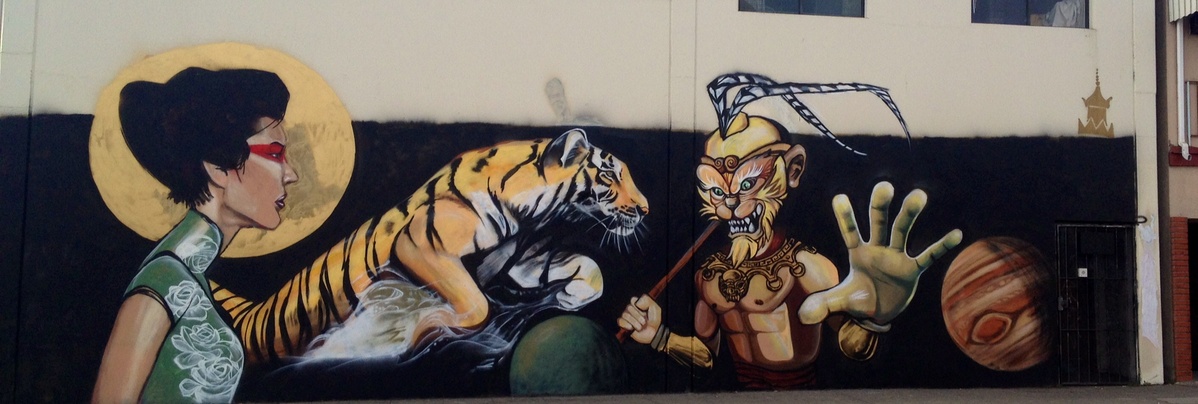
This screenshot has height=404, width=1198. In order to click on white trim in this screenshot , I will do `click(1149, 8)`, `click(1144, 119)`, `click(1149, 241)`, `click(1146, 329)`.